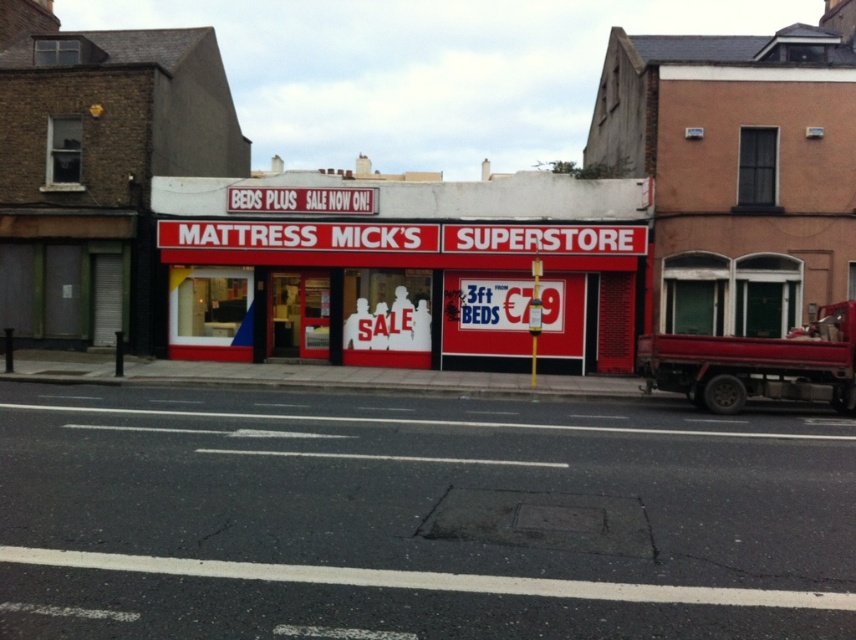
Between red matte sign at center and metallic red truck at right, which one is positioned lower?

Positioned lower is metallic red truck at right.

Is point (257, 224) positioned behind point (819, 353)?

Yes, it is behind point (819, 353).

The height and width of the screenshot is (640, 856). I want to click on red matte sign at center, so click(x=407, y=269).